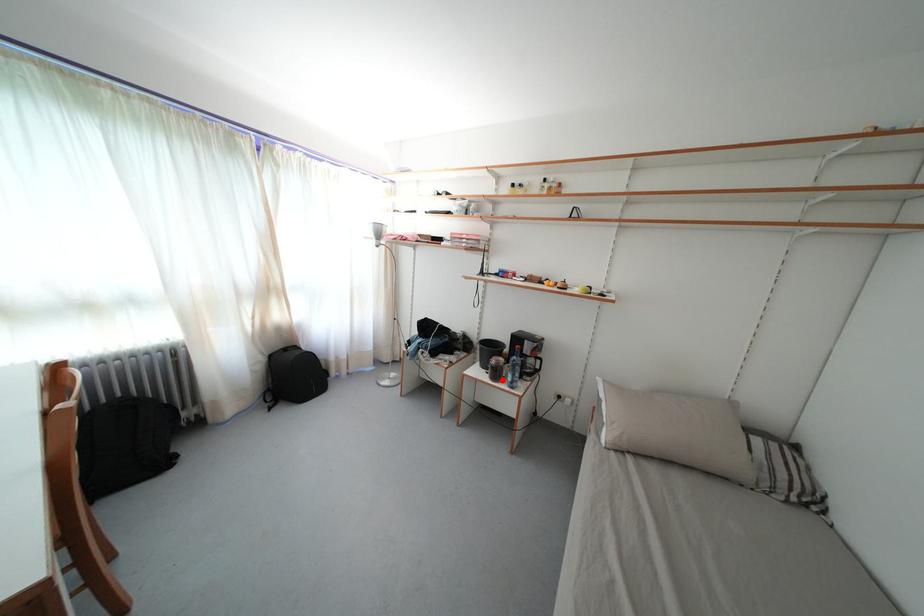
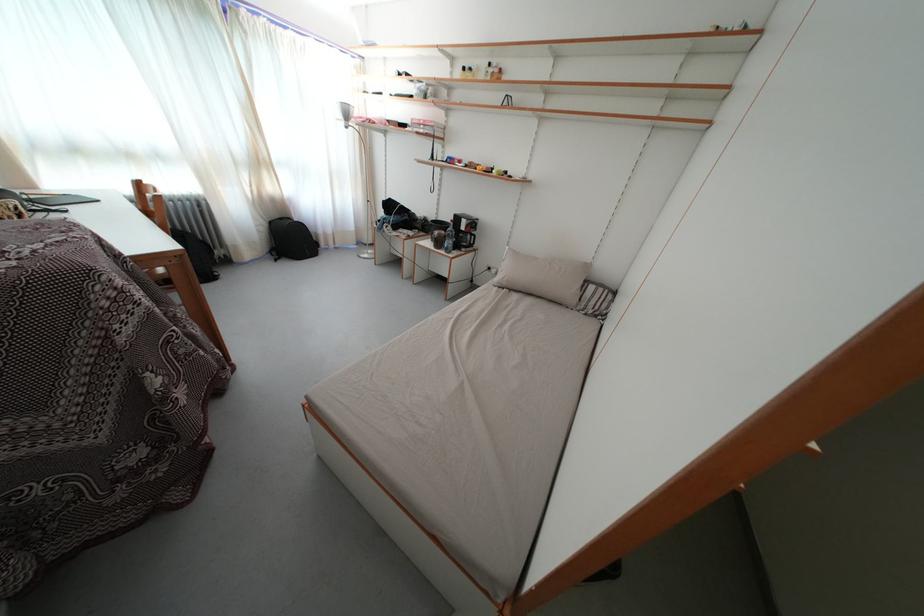
Question: I am providing you with two images of the same scene from different viewpoints. Image1 has a red point marked. In image2, the corresponding 3D location appears at what relative position? Reply with the corresponding letter.

Choices:
 (A) Closer
 (B) Farther

Answer: (A)